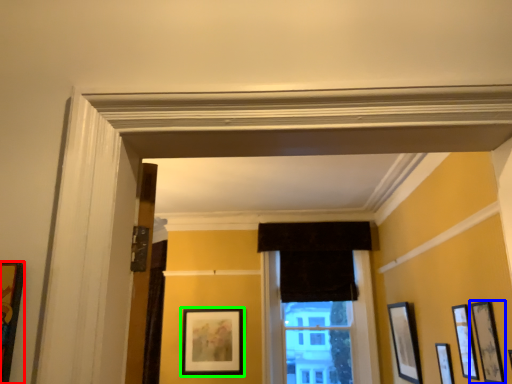
Question: Which is farther away from picture frame (highlighted by a red box)? picture frame (highlighted by a blue box) or picture frame (highlighted by a green box)?

Choices:
 (A) picture frame
 (B) picture frame

Answer: (B)